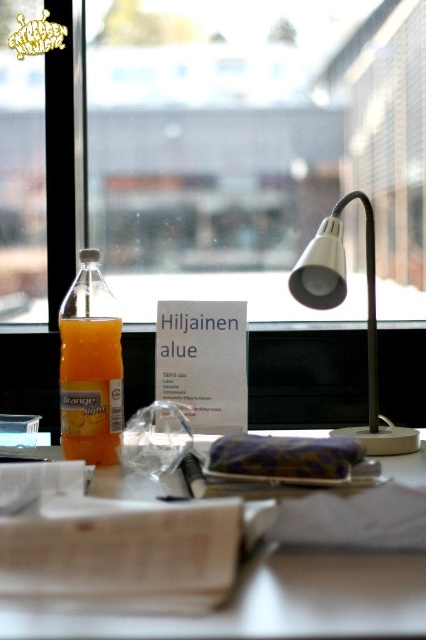
In the scene shown: Is white paper at center shorter than translucent glass bottle at left?

Yes.

In the scene shown: Which is more to the left, white paper at center or translucent glass bottle at left?

From the viewer's perspective, translucent glass bottle at left appears more on the left side.

Where is `white paper at center`? The width and height of the screenshot is (426, 640). white paper at center is located at coordinates (273, 604).

Does translucent glass bottle at left have a lesser height compared to transparent glass window sill at center?

In fact, translucent glass bottle at left may be taller than transparent glass window sill at center.

Which of these two, translucent glass bottle at left or transparent glass window sill at center, stands taller?

Standing taller between the two is translucent glass bottle at left.

At what (x,y) coordinates should I click in order to perform the action: click on translucent glass bottle at left. Please return your answer as a coordinate pair (x, y). This screenshot has width=426, height=640. Looking at the image, I should click on (89, 365).

Is white metallic desk lamp at center right closer to camera compared to transparent glass window sill at center?

Yes, it is in front of transparent glass window sill at center.

Identify the location of white metallic desk lamp at center right. (367, 317).